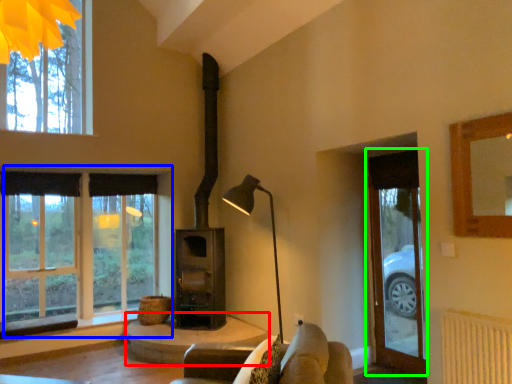
Question: Which object is positioned closest to table (highlighted by a red box)? Select from window (highlighted by a blue box) and glass door (highlighted by a green box).

Choices:
 (A) window
 (B) glass door

Answer: (A)